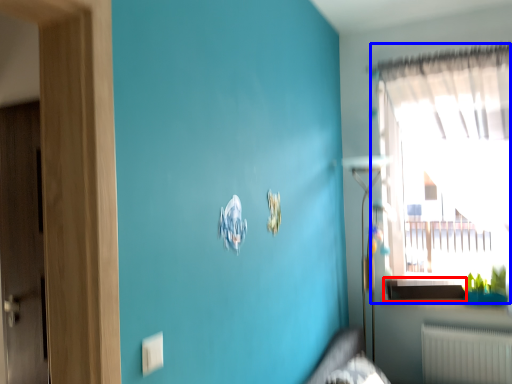
Question: Which object is further to the camera taking this photo, window sill (highlighted by a red box) or window (highlighted by a blue box)?

Choices:
 (A) window sill
 (B) window

Answer: (A)